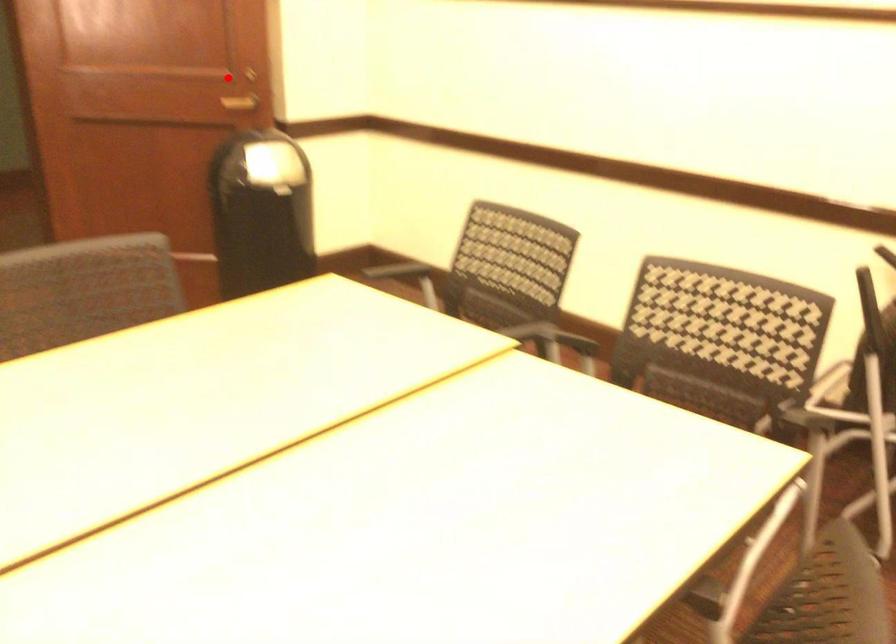
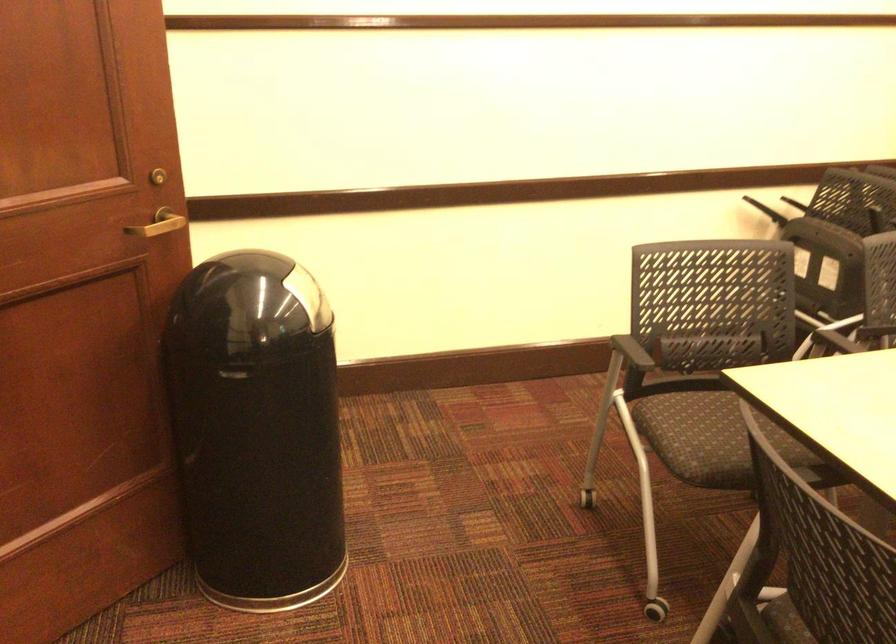
Locate, in the second image, the point that corresponds to the highlighted location in the first image.

(158, 223)